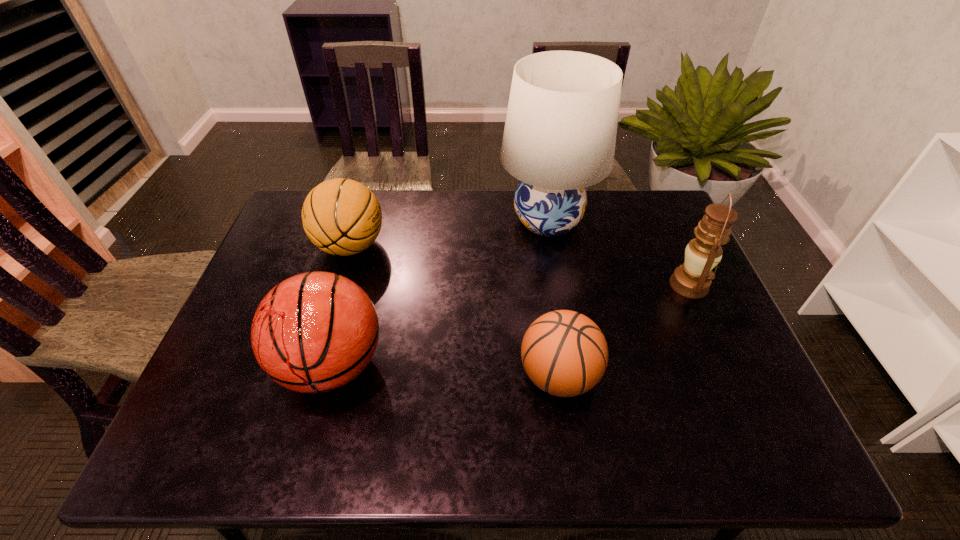
The image size is (960, 540). Find the location of `the tallest object`. the tallest object is located at coordinates (560, 132).

Locate an element on the screen. The width and height of the screenshot is (960, 540). the rightmost object is located at coordinates (692, 279).

This screenshot has height=540, width=960. Identify the location of the tallest basketball. (314, 332).

The height and width of the screenshot is (540, 960). What are the coordinates of `the second shortest basketball` in the screenshot? It's located at (342, 217).

This screenshot has width=960, height=540. Find the location of `the second shortest object`. the second shortest object is located at coordinates (342, 217).

Find the location of a particular element. the shortest basketball is located at coordinates (564, 353).

I want to click on the rightmost basketball, so click(564, 353).

You are a GUI agent. You are given a task and a screenshot of the screen. Output one action in this format:
    pyautogui.click(x=<x>, y=<y>)
    Task: Click on the free region located on the front-facing side of the lampshade
    The image size is (960, 540).
    Given the screenshot: What is the action you would take?
    pyautogui.click(x=461, y=220)

The image size is (960, 540). Identify the location of vacant point located on the front-facing side of the lampshade. (381, 220).

Locate an element on the screen. free point located 0.220m on the front-facing side of the lampshade is located at coordinates (430, 220).